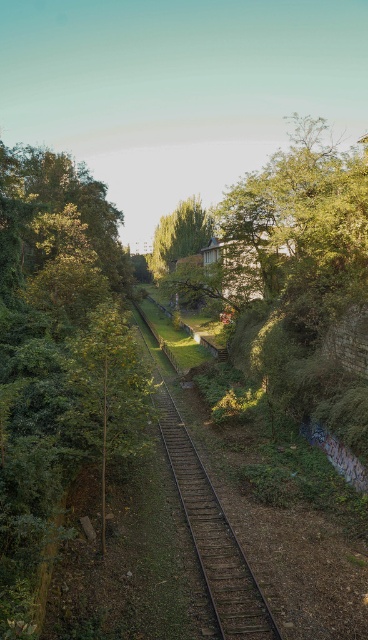
Does brown wooden train track at center appear on the right side of green leafy tree at center?

Yes, brown wooden train track at center is to the right of green leafy tree at center.

Does point (216, 532) come closer to viewer compared to point (172, 253)?

Yes, point (216, 532) is closer to viewer.

The width and height of the screenshot is (368, 640). Find the location of `brown wooden train track at center`. brown wooden train track at center is located at coordinates (211, 531).

At what (x,y) coordinates should I click in order to perform the action: click on brown wooden train track at center. Please return your answer as a coordinate pair (x, y). The height and width of the screenshot is (640, 368). Looking at the image, I should click on (211, 531).